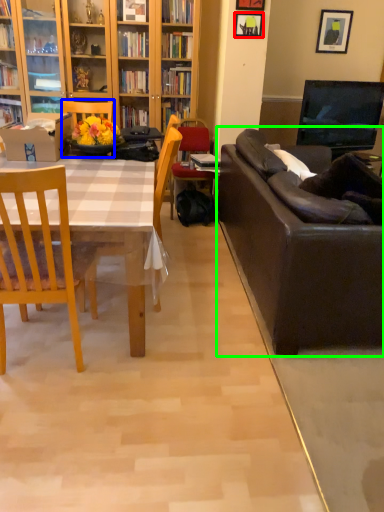
Question: Which is nearer to the picture frame (highlighted by a red box)? chair (highlighted by a blue box) or studio couch (highlighted by a green box).

Choices:
 (A) chair
 (B) studio couch

Answer: (A)